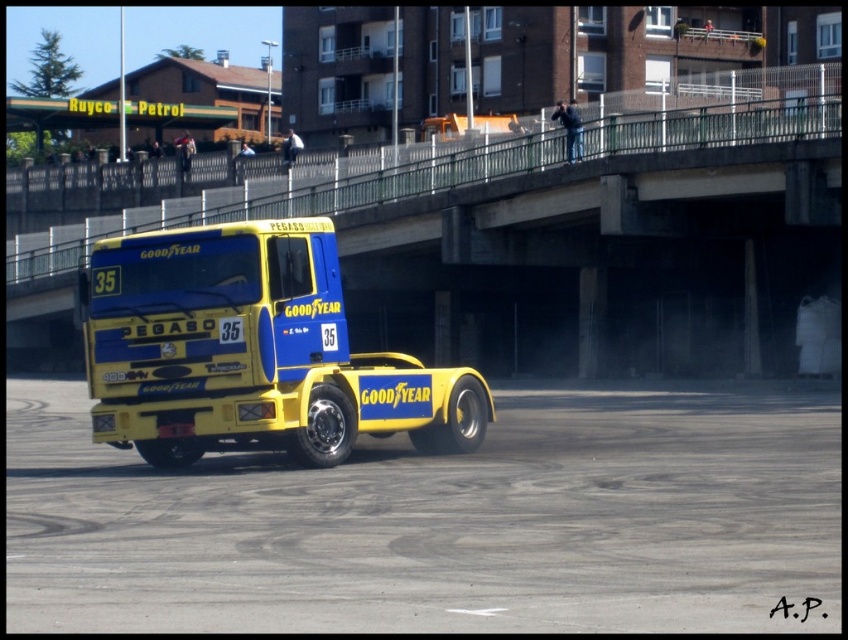
Describe the element at coordinates (439, 522) in the screenshot. I see `yellow rubber dirt track at center` at that location.

Measure the distance between yellow rubber dirt track at center and camera.

7.84 meters

Where is `yellow rubber dirt track at center`? The width and height of the screenshot is (848, 640). yellow rubber dirt track at center is located at coordinates (439, 522).